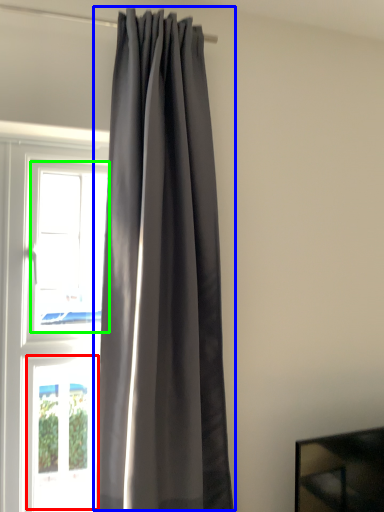
Question: Estimate the real-world distances between objects in this image. Which object is closer to window (highlighted by a red box), curtain (highlighted by a blue box) or window (highlighted by a green box)?

Choices:
 (A) curtain
 (B) window

Answer: (A)